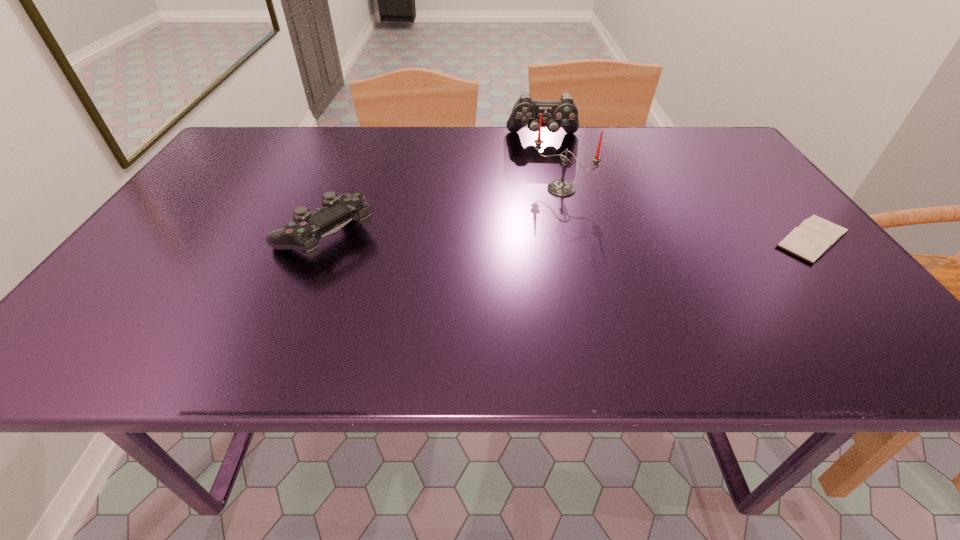
Locate an element on the screen. vacant space situated 0.360m on the front-facing side of the candle is located at coordinates (465, 286).

Locate an element on the screen. The height and width of the screenshot is (540, 960). free region located 0.060m on the front-facing side of the candle is located at coordinates (536, 211).

Identify the location of vacant space located on the front-facing side of the candle. (534, 213).

Identify the location of free point located 0.310m on the surface of the right control with buttons. (548, 206).

I want to click on blank area located 0.370m on the surface of the right control with buttons, so click(549, 221).

This screenshot has height=540, width=960. I want to click on free location located 0.260m on the surface of the right control with buttons, so click(547, 195).

Locate an element on the screen. object that is positioned at the far edge is located at coordinates (563, 113).

I want to click on object located at the right edge, so click(815, 236).

In order to click on vacant area at the far edge of the desktop in this screenshot , I will do `click(670, 162)`.

At what (x,y) coordinates should I click in order to perform the action: click on free space at the near edge of the desktop. Please return your answer as a coordinate pair (x, y). Looking at the image, I should click on (685, 299).